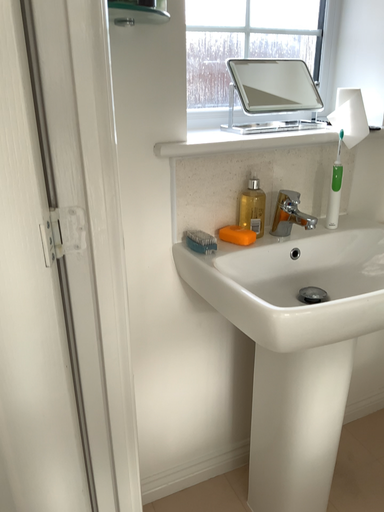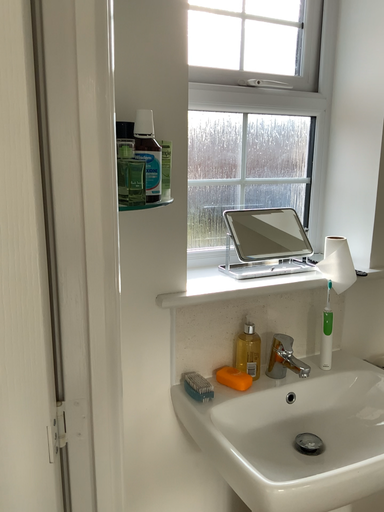
Question: Which way did the camera rotate in the video?

Choices:
 (A) rotated downward
 (B) rotated upward

Answer: (B)